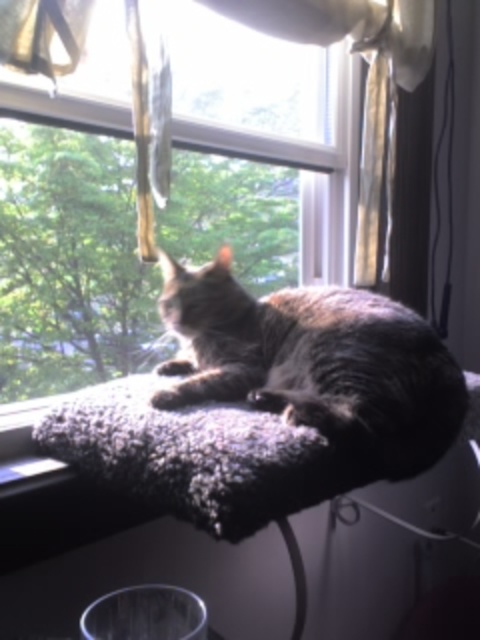
Question: Is gray fur cat at center behind fuzzy fabric cat bed at upper center?

Choices:
 (A) yes
 (B) no

Answer: (A)

Question: Is gray fur cat at center thinner than fuzzy fabric cat bed at upper center?

Choices:
 (A) yes
 (B) no

Answer: (A)

Question: Among these objects, which one is farthest from the camera?

Choices:
 (A) gray fur cat at center
 (B) fuzzy fabric cat bed at upper center

Answer: (A)

Question: Does gray fur cat at center have a larger size compared to fuzzy fabric cat bed at upper center?

Choices:
 (A) yes
 (B) no

Answer: (A)

Question: Which point appears farthest from the camera in this image?

Choices:
 (A) (233, 376)
 (B) (137, 410)

Answer: (A)